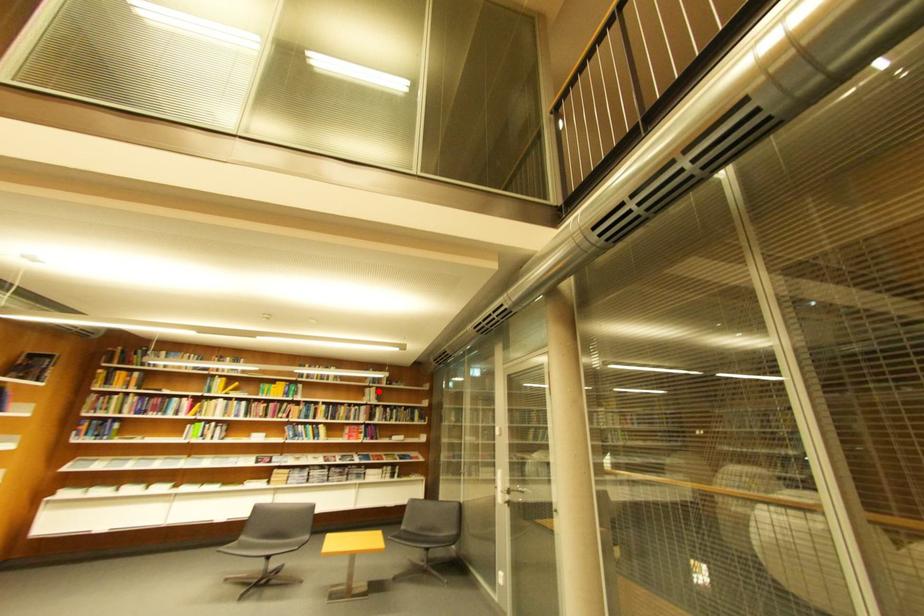
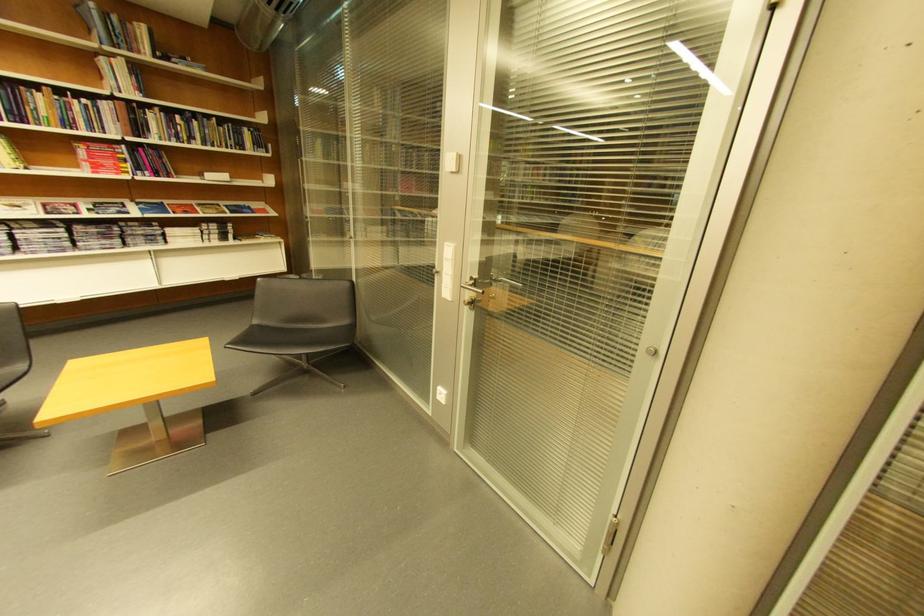
In the second image, find the point that corresponds to the highlighted location in the first image.

(113, 62)